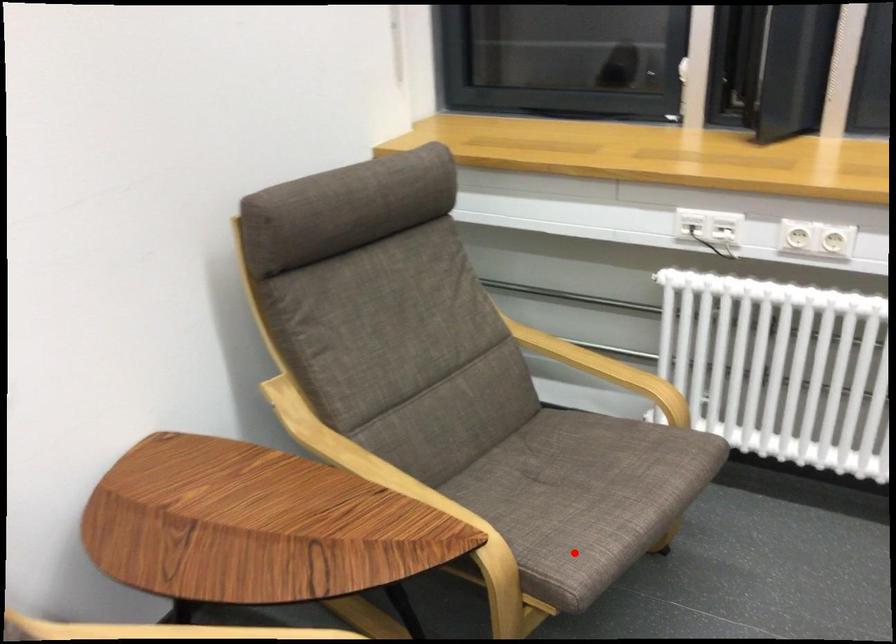
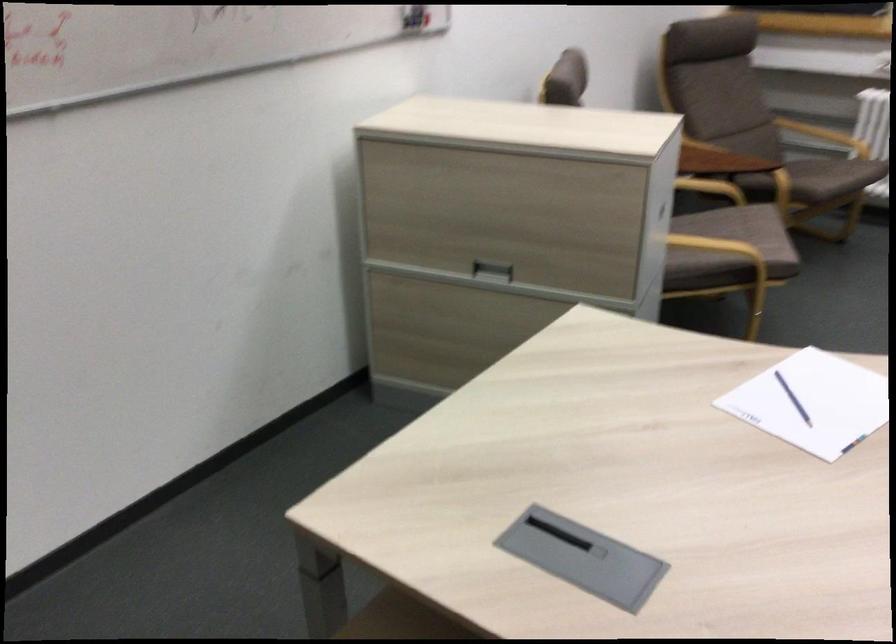
Where in the second image is the point corresponding to the highlighted location from the first image?

(831, 176)